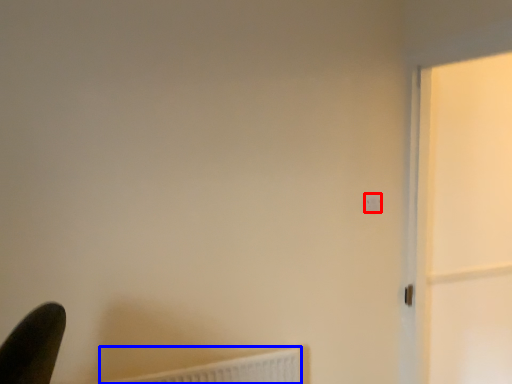
Question: Which of the following is the farthest to the observer, light switch (highlighted by a red box) or radiator (highlighted by a blue box)?

Choices:
 (A) light switch
 (B) radiator

Answer: (A)